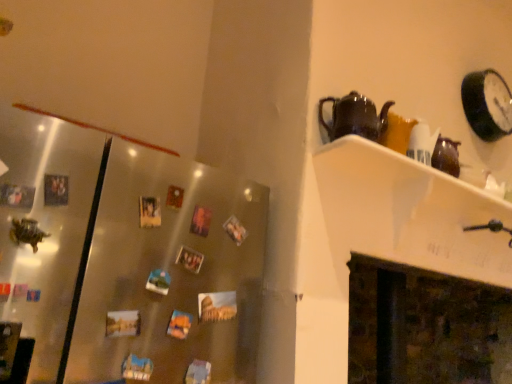
Question: Would you say white glossy shelf at upper right contains dark brown stone fireplace at lower right?

Choices:
 (A) yes
 (B) no

Answer: (B)

Question: Can you confirm if white glossy shelf at upper right is shorter than dark brown stone fireplace at lower right?

Choices:
 (A) yes
 (B) no

Answer: (A)

Question: Is white glossy shelf at upper right positioned with its back to dark brown stone fireplace at lower right?

Choices:
 (A) no
 (B) yes

Answer: (A)

Question: Can we say white glossy shelf at upper right lies outside dark brown stone fireplace at lower right?

Choices:
 (A) no
 (B) yes

Answer: (B)

Question: Does white glossy shelf at upper right appear on the left side of dark brown stone fireplace at lower right?

Choices:
 (A) no
 (B) yes

Answer: (B)

Question: Is black glossy clock at upper right spatially inside white glossy shelf at upper right, or outside of it?

Choices:
 (A) outside
 (B) inside

Answer: (A)

Question: Considering the positions of black glossy clock at upper right and white glossy shelf at upper right in the image, is black glossy clock at upper right taller or shorter than white glossy shelf at upper right?

Choices:
 (A) short
 (B) tall

Answer: (B)

Question: From the image's perspective, is black glossy clock at upper right positioned above or below white glossy shelf at upper right?

Choices:
 (A) below
 (B) above

Answer: (B)

Question: In the image, is black glossy clock at upper right positioned in front of or behind white glossy shelf at upper right?

Choices:
 (A) front
 (B) behind

Answer: (B)

Question: Considering their positions, is white glossy shelf at upper right located in front of or behind dark brown stone fireplace at lower right?

Choices:
 (A) behind
 (B) front

Answer: (B)

Question: In terms of width, does white glossy shelf at upper right look wider or thinner when compared to dark brown stone fireplace at lower right?

Choices:
 (A) thin
 (B) wide

Answer: (A)

Question: From the image's perspective, relative to dark brown stone fireplace at lower right, is white glossy shelf at upper right above or below?

Choices:
 (A) above
 (B) below

Answer: (A)

Question: Considering the relative positions of white glossy shelf at upper right and dark brown stone fireplace at lower right in the image provided, is white glossy shelf at upper right to the left or to the right of dark brown stone fireplace at lower right?

Choices:
 (A) left
 (B) right

Answer: (A)

Question: Is point (451, 220) positioned closer to the camera than point (57, 248)?

Choices:
 (A) closer
 (B) farther

Answer: (B)

Question: From a real-world perspective, relative to satin metallic fridge at left, is white glossy shelf at upper right vertically above or below?

Choices:
 (A) above
 (B) below

Answer: (A)